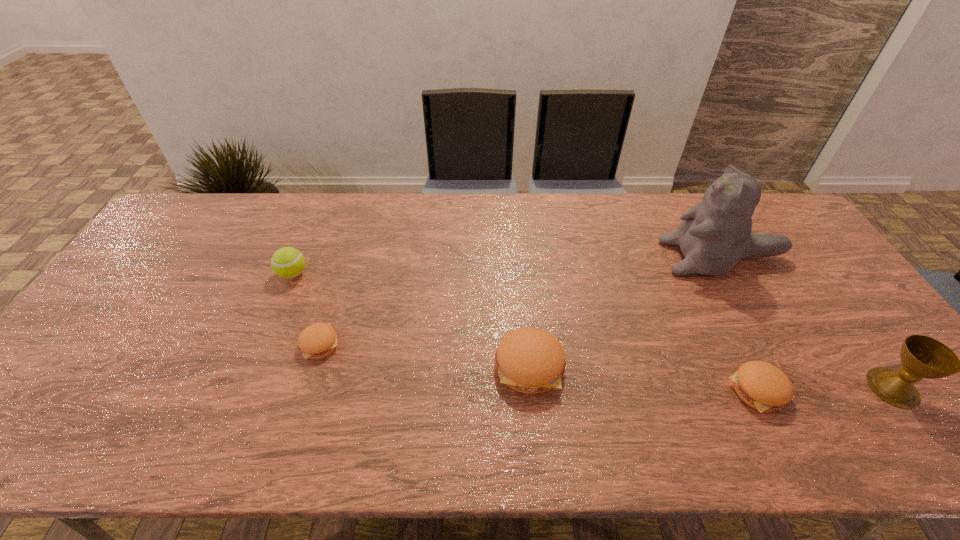
The image size is (960, 540). In order to click on chalice that is at the right edge in this screenshot , I will do `click(922, 357)`.

You are a GUI agent. You are given a task and a screenshot of the screen. Output one action in this format:
    pyautogui.click(x=<x>, y=<y>)
    Task: Click on the object located in the far right corner section of the desktop
    The width and height of the screenshot is (960, 540).
    Given the screenshot: What is the action you would take?
    pyautogui.click(x=715, y=234)

At what (x,y) coordinates should I click in order to perform the action: click on object present at the near right corner. Please return your answer as a coordinate pair (x, y). Looking at the image, I should click on (922, 357).

What are the coordinates of `vacant space at the far edge of the desktop` in the screenshot? It's located at (408, 194).

Where is `vacant space at the near edge`? The height and width of the screenshot is (540, 960). vacant space at the near edge is located at coordinates (374, 409).

You are a GUI agent. You are given a task and a screenshot of the screen. Output one action in this format:
    pyautogui.click(x=<x>, y=<y>)
    Task: Click on the free point at the left edge
    
    Given the screenshot: What is the action you would take?
    pyautogui.click(x=142, y=329)

In the image, there is a desktop. Where is `vacant space at the right edge`? This screenshot has height=540, width=960. vacant space at the right edge is located at coordinates (818, 337).

Identify the location of vacant space at the far left corner of the desktop. click(x=221, y=197).

Locate an element on the screen. The width and height of the screenshot is (960, 540). vacant space that is in between the fifth object from right to left and the tennis ball is located at coordinates (306, 309).

This screenshot has width=960, height=540. What are the coordinates of `free space between the shortest patty and the chalice` in the screenshot? It's located at (606, 366).